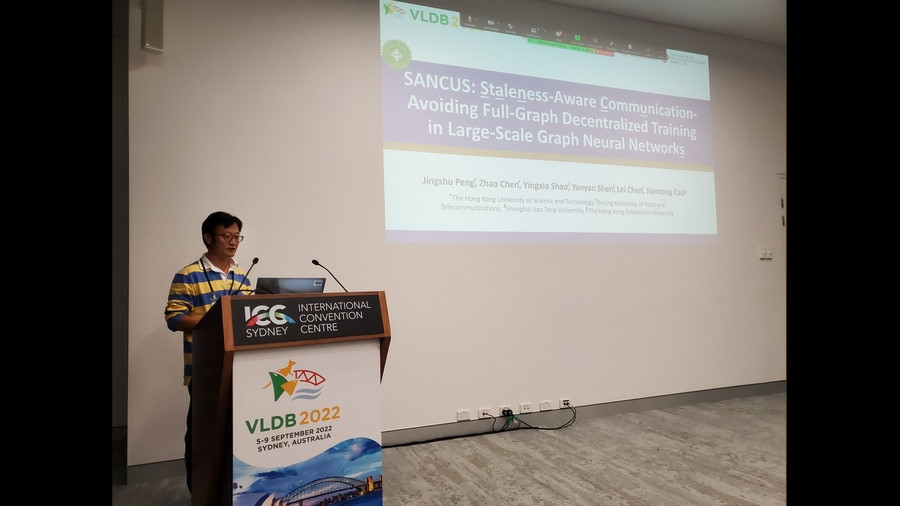
I want to click on projection screen, so click(x=550, y=106).